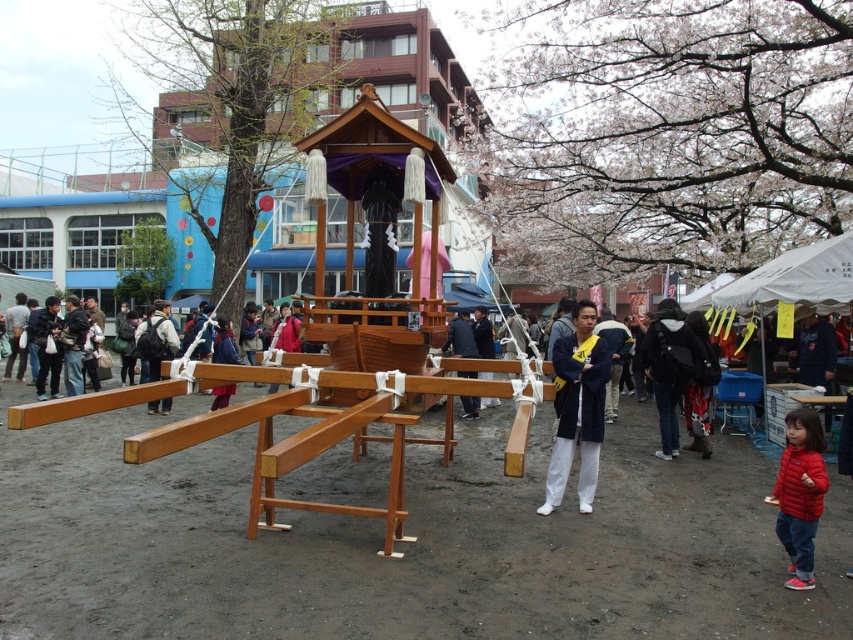
You are observing a festival procession and notice two people wearing jackets. One is wearing a red fleece jacket at lower right and the other a dark fabric jacket at center. From the perspective of someone standing behind the mikoshi, which jacket is positioned lower?

The red fleece jacket at lower right is located below the dark fabric jacket at center, so from the perspective of someone standing behind the mikoshi, the red fleece jacket at lower right is positioned lower.

You are attending a festival and need to decide which jacket to wear for carrying the mikoshi. The red fleece jacket at lower right and the dark fabric jacket at center are available. Which jacket is more suitable for someone who prefers a snugger fit?

The red fleece jacket at lower right has a smaller size compared to the dark fabric jacket at center, so it is more suitable for someone who prefers a snugger fit.

You are an event planner observing the scene and need to decide which clothing item to place in a display case that has a height limit of 1.2 meters. Which item between the blue silk kimono at center and the dark blue fabric jacket at center would fit better?

The blue silk kimono at center is not as tall as the dark blue fabric jacket at center. Since the display case has a height limit of 1.2 meters, the blue silk kimono at center would fit better as it is shorter in height compared to the jacket.